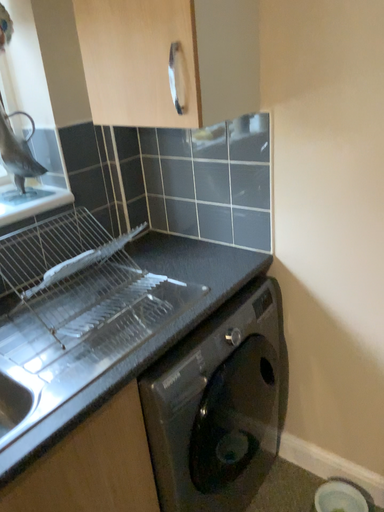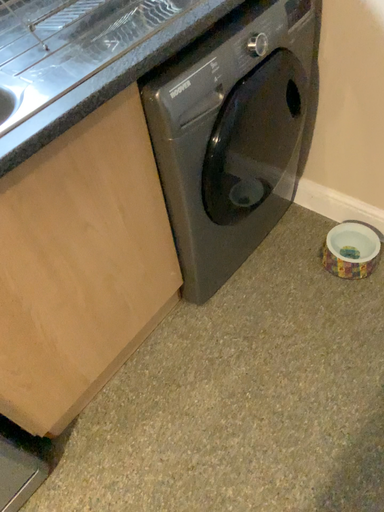
Question: Which way did the camera rotate in the video?

Choices:
 (A) rotated downward
 (B) rotated upward

Answer: (A)